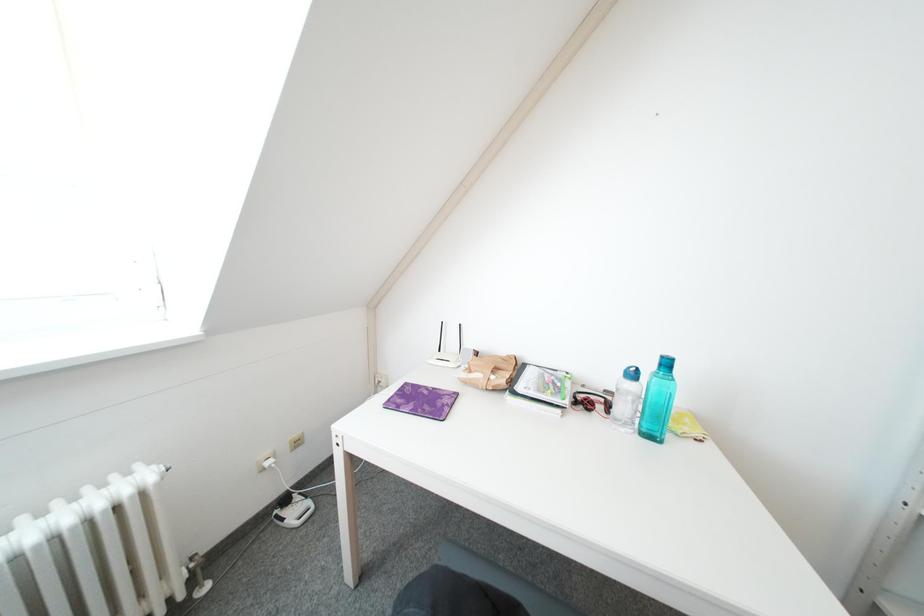
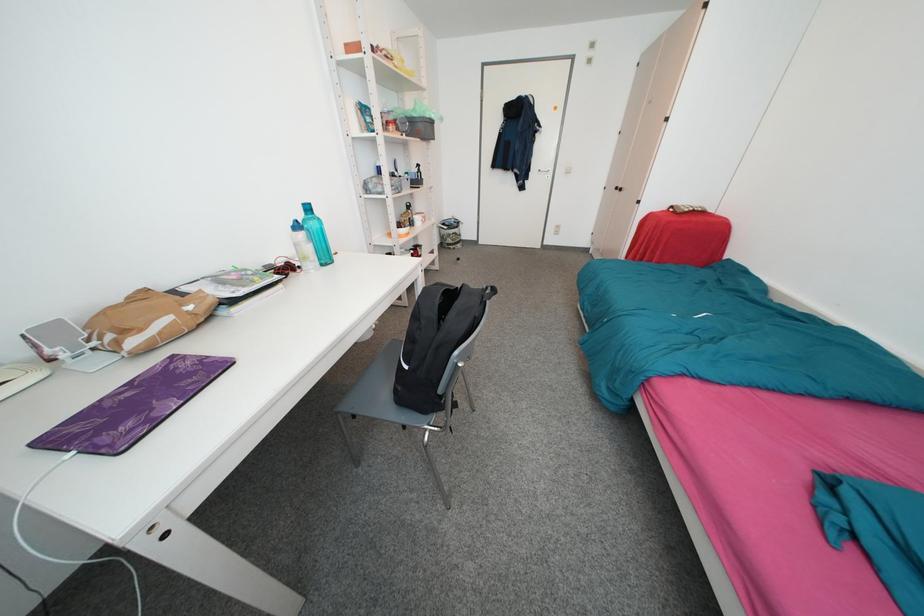
How did the camera likely rotate?

The camera rotated toward right-down.